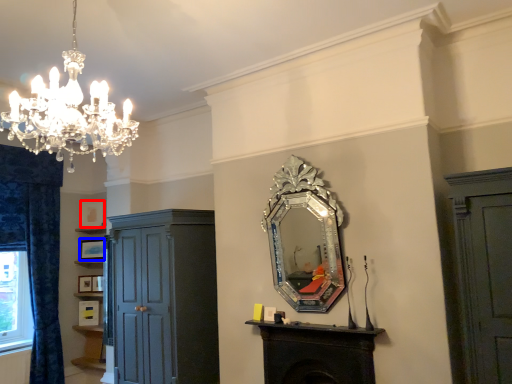
Question: Which point is further to the camera, picture frame (highlighted by a red box) or picture frame (highlighted by a blue box)?

Choices:
 (A) picture frame
 (B) picture frame

Answer: (A)